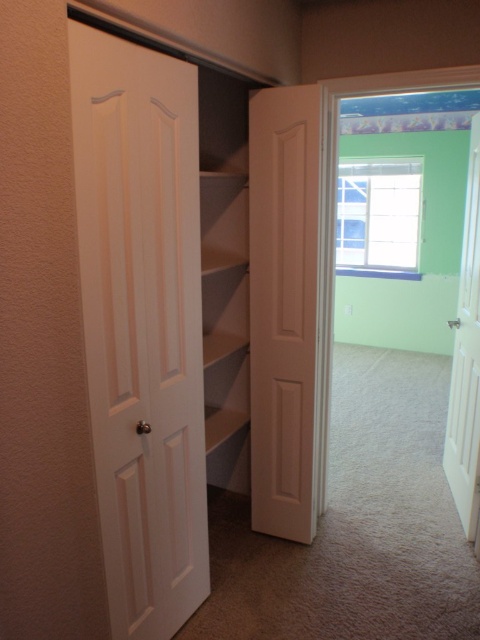
Can you confirm if white matte door at center is bigger than white wooden door at right?

Incorrect, white matte door at center is not larger than white wooden door at right.

Which is below, white matte door at center or white wooden door at right?

white matte door at center is lower down.

Measure the distance between point (308, 384) and camera.

Point (308, 384) and camera are 2.55 meters apart.

Identify the location of white matte door at center. (284, 307).

Which is more to the left, white matte door at left or white wooden door at right?

Positioned to the left is white matte door at left.

Does point (128, 364) lie in front of point (468, 360)?

Yes, point (128, 364) is in front of point (468, 360).

Is point (157, 468) positioned before point (445, 436)?

Yes, it is.

Find the location of `white matte door at left`. white matte door at left is located at coordinates (142, 323).

Which is behind, point (133, 376) or point (275, 125)?

Point (275, 125)

In order to click on white matte door at left in this screenshot , I will do 142,323.